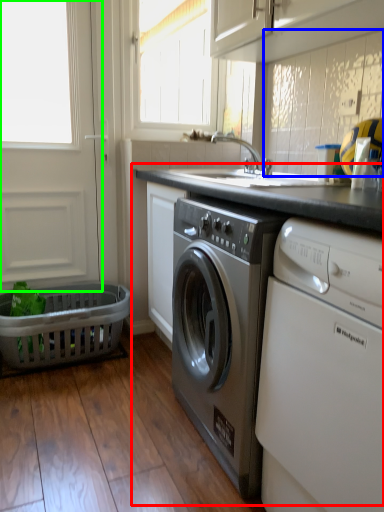
Question: Considering the real-world distances, which object is closest to counter (highlighted by a red box)? cabinetry (highlighted by a blue box) or screen door (highlighted by a green box).

Choices:
 (A) cabinetry
 (B) screen door

Answer: (A)